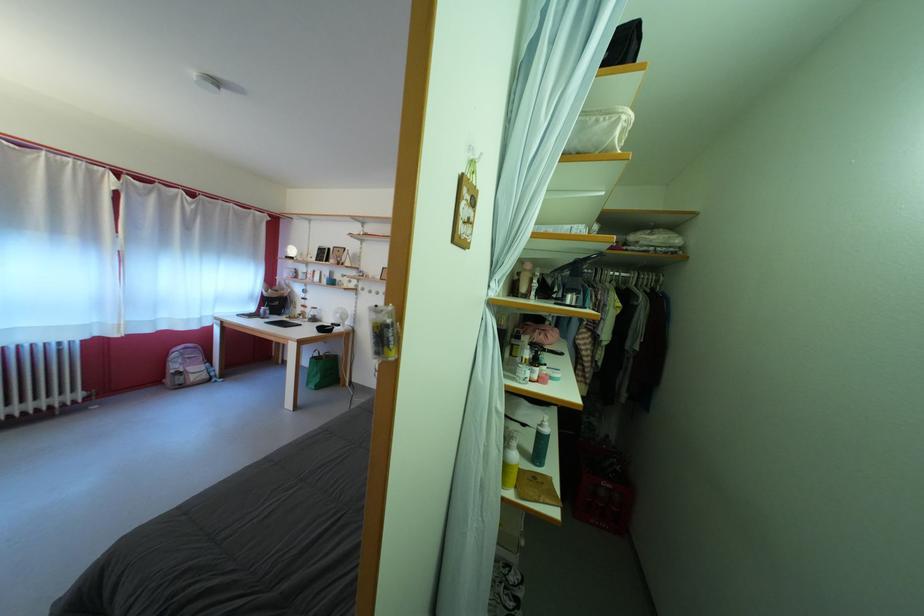
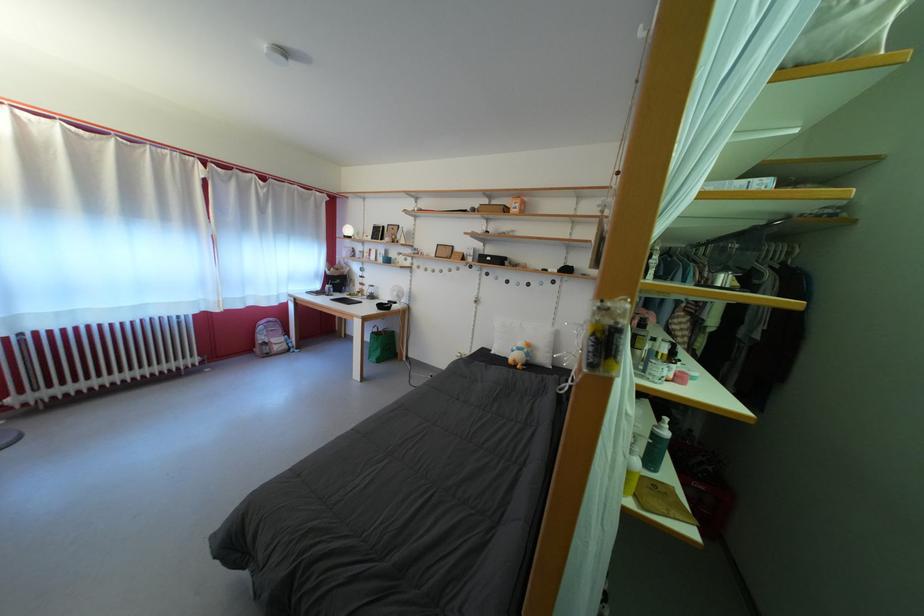
Question: The camera is either moving clockwise (left) or counter-clockwise (right) around the object. The first image is from the beginning of the video and the second image is from the end. Is the camera moving left or right when shooting the video?

Choices:
 (A) Left
 (B) Right

Answer: (B)